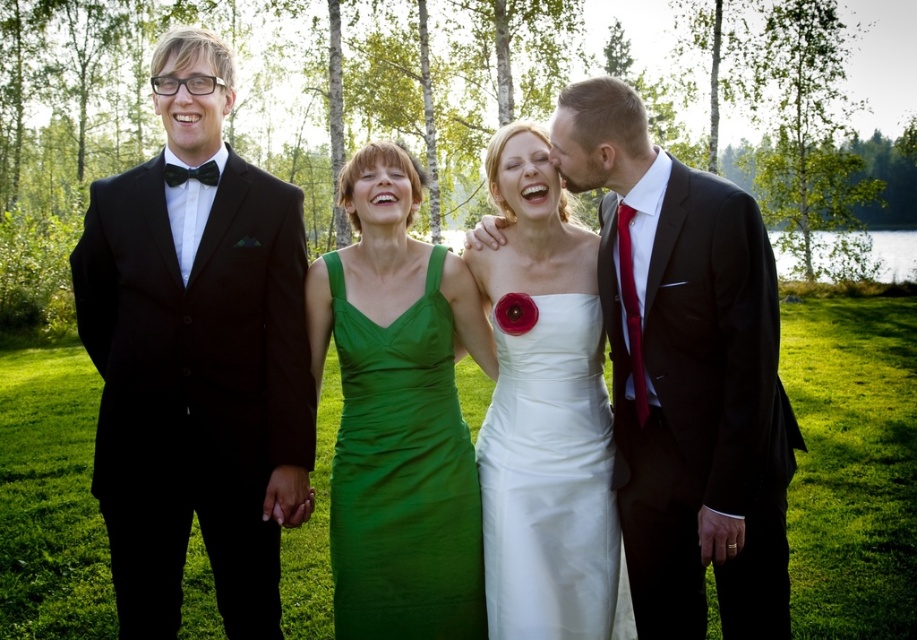
Is matte green dress at center taller than green satin dress at center?

Correct, matte green dress at center is much taller as green satin dress at center.

Is matte green dress at center above green satin dress at center?

Indeed, matte green dress at center is positioned over green satin dress at center.

Which is in front, point (597, 371) or point (445, 472)?

Point (445, 472) is in front.

You are a GUI agent. You are given a task and a screenshot of the screen. Output one action in this format:
    pyautogui.click(x=<x>, y=<y>)
    Task: Click on the matte green dress at center
    The height and width of the screenshot is (640, 917).
    Given the screenshot: What is the action you would take?
    pyautogui.click(x=542, y=412)

Locate an element on the screen. Image resolution: width=917 pixels, height=640 pixels. shiny black suit at center is located at coordinates (686, 372).

This screenshot has height=640, width=917. I want to click on shiny black suit at center, so click(x=686, y=372).

The height and width of the screenshot is (640, 917). Identify the location of shiny black suit at center. (686, 372).

Can you confirm if shiny black suit at center is shorter than matte green dress at center?

Yes, shiny black suit at center is shorter than matte green dress at center.

Between shiny black suit at center and matte green dress at center, which one has less height?

Standing shorter between the two is shiny black suit at center.

Is point (691, 611) behind point (589, 381)?

No, it is in front of (589, 381).

Image resolution: width=917 pixels, height=640 pixels. Identify the location of shiny black suit at center. (686, 372).